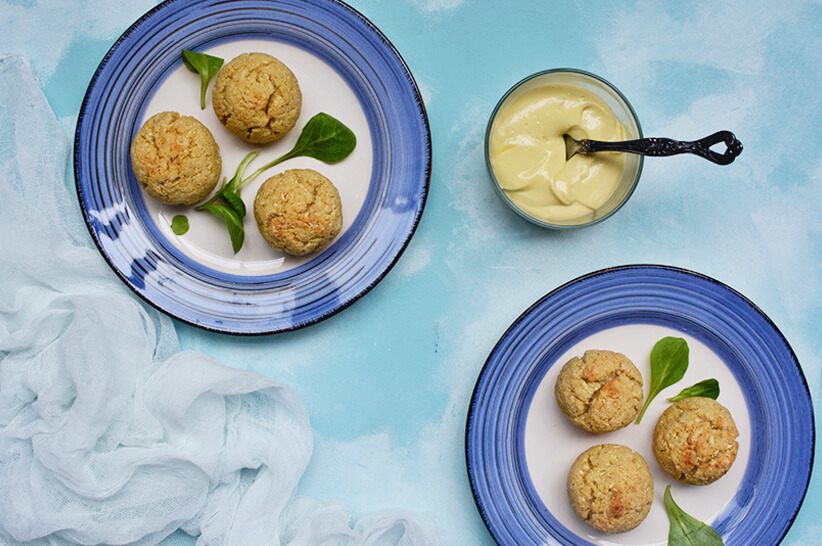
At what (x,y) coordinates should I click in order to perform the action: click on glass. Please return your answer as a coordinate pair (x, y). The height and width of the screenshot is (546, 822). Looking at the image, I should click on (587, 76).